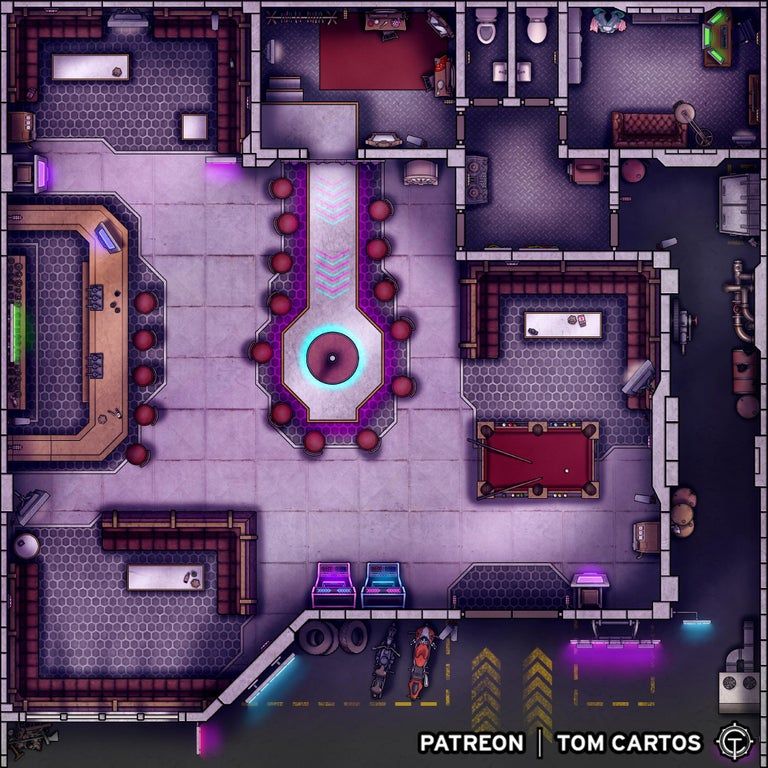
Find the location of `items on bar top`. items on bar top is located at coordinates (17, 445), (101, 412), (111, 411), (117, 414), (114, 308), (111, 303), (114, 292).